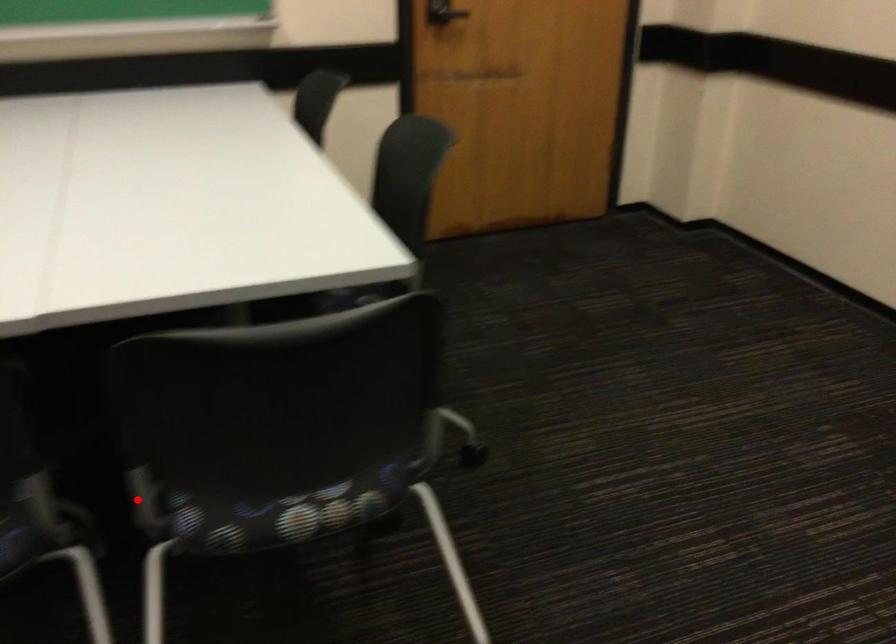
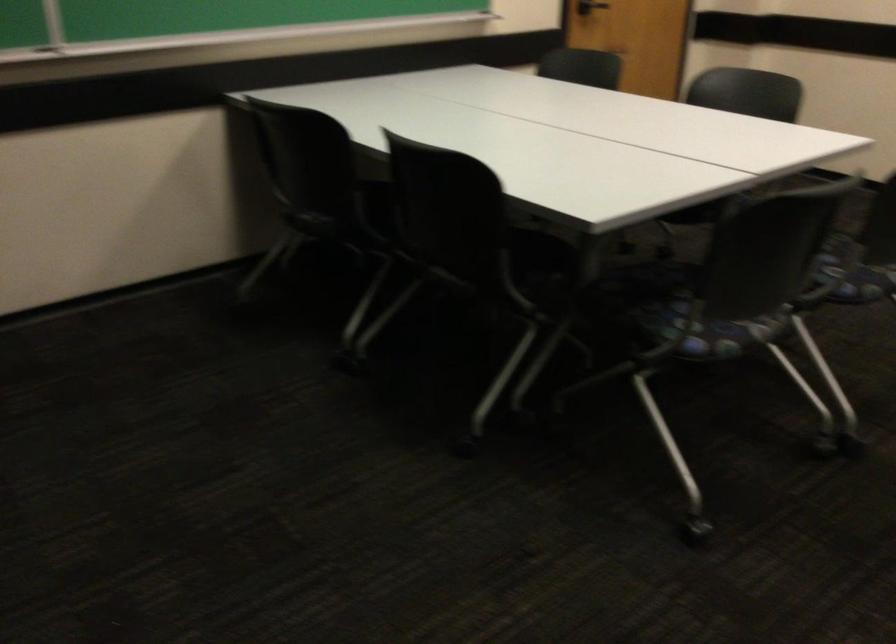
Locate, in the second image, the point that corresponds to the highlighted location in the first image.

(853, 272)